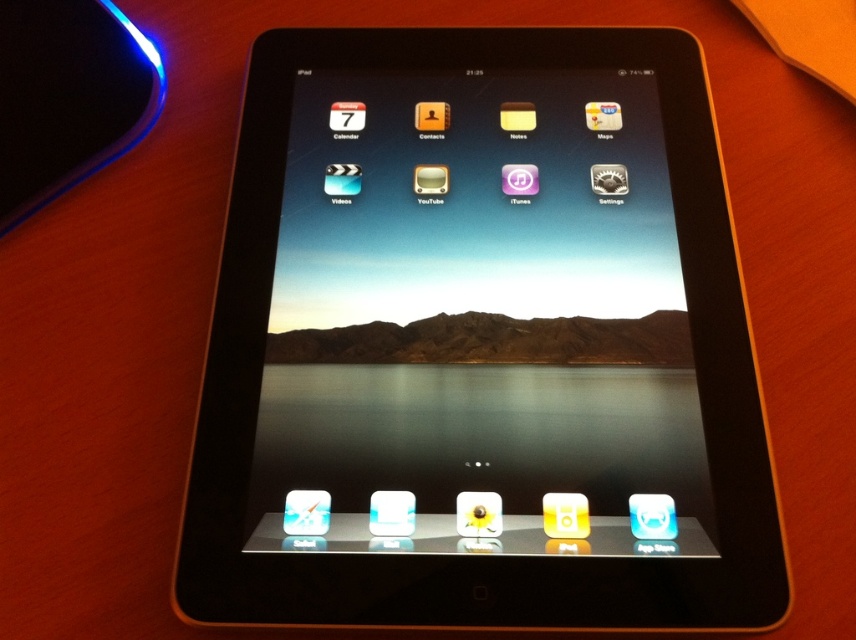
Looking at this image, is black glossy tablet at center shorter than matte white ipod at center?

Incorrect, black glossy tablet at center's height does not fall short of matte white ipod at center's.

Which of these two, black glossy tablet at center or matte white ipod at center, stands shorter?

With less height is matte white ipod at center.

Does point (694, 365) lie in front of point (461, 518)?

No, (694, 365) is further to viewer.

The height and width of the screenshot is (640, 856). What are the coordinates of `black glossy tablet at center` in the screenshot? It's located at (479, 364).